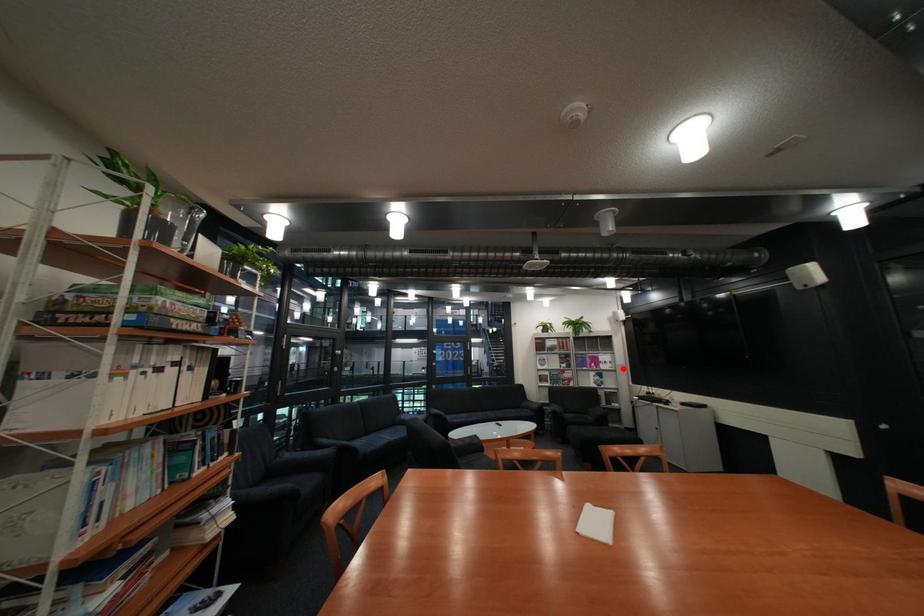
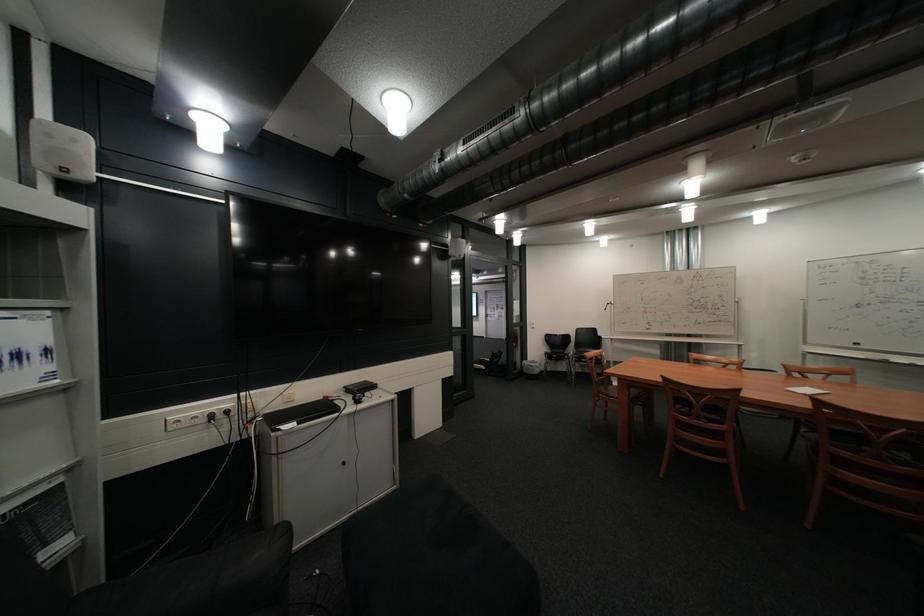
Question: I am providing you with two images of the same scene from different viewpoints. Given a red point in image1, look at the same physical point in image2. Is it:

Choices:
 (A) Closer to the viewpoint
 (B) Farther from the viewpoint

Answer: (A)